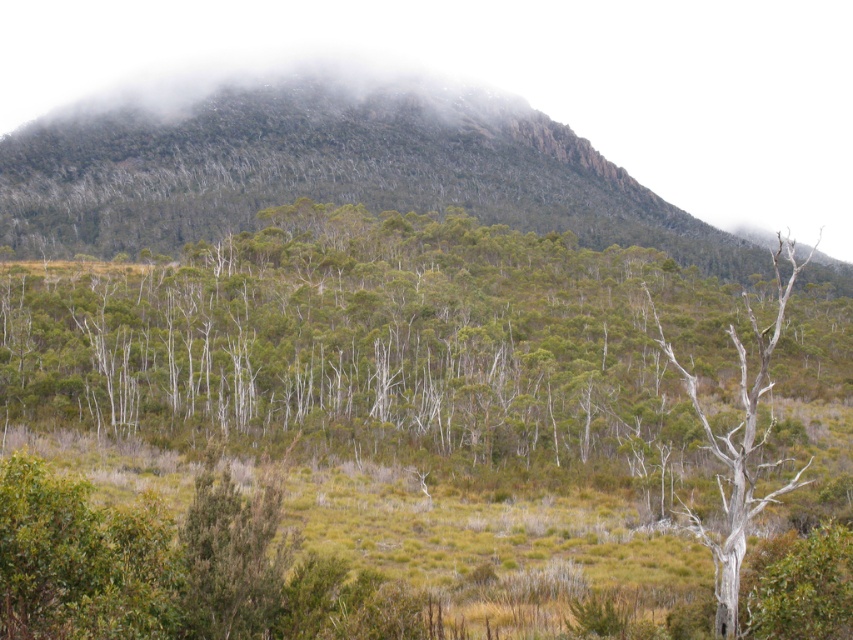
You are standing in the mountainous landscape described. You see a point marked at coordinates [376,342]. What does this point indicate?

The point at coordinates [376,342] marks the location of green matte trees at center.

You are standing at the base of the mountain and looking towards the peak. There are two points marked on the mountain slope. One is at coordinates point (502, 435) and the other at point (721, 486). Which point is closer to you?

Point (721, 486) is closer to you because it is in front of point (502, 435).